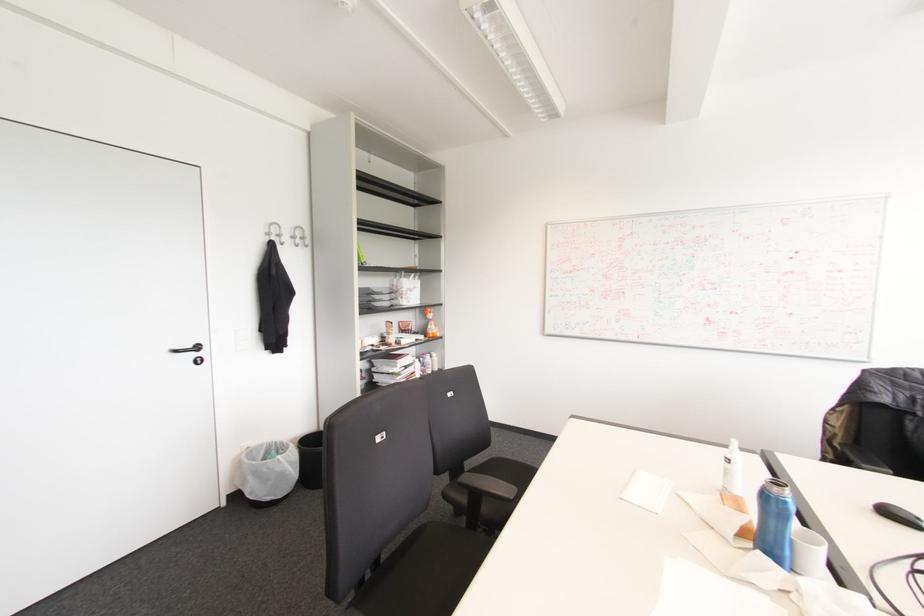
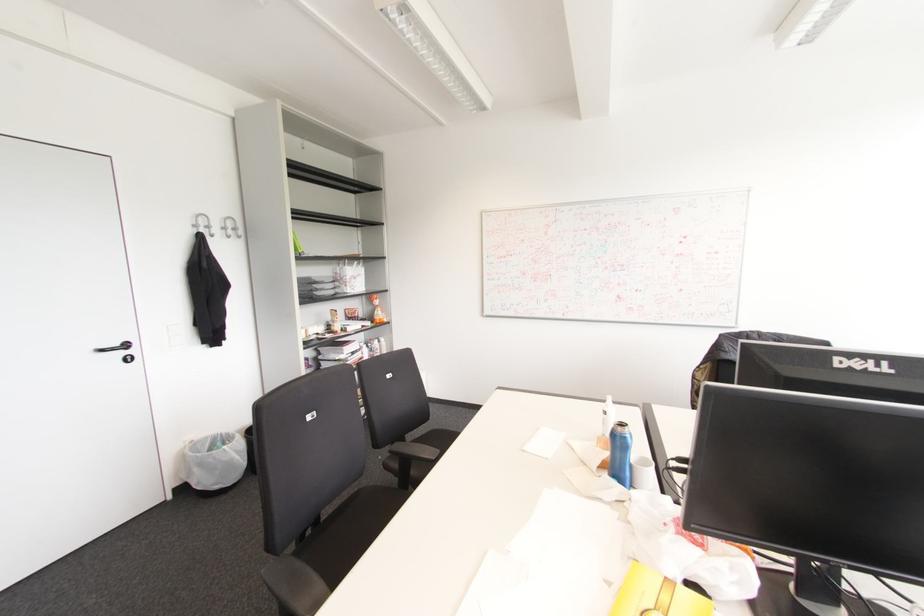
The point at (515, 488) is marked in the first image. Where is the corresponding point in the second image?

(438, 451)